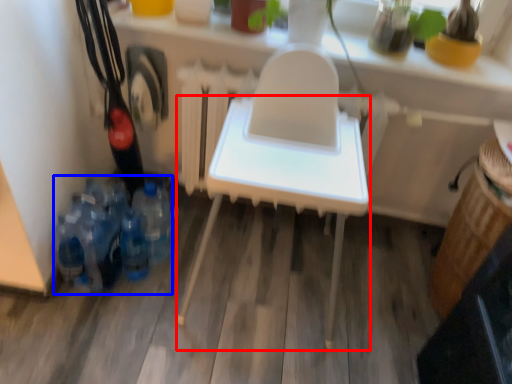
Question: Which object appears closest to the camera in this image, furniture (highlighted by a red box) or bottle (highlighted by a blue box)?

Choices:
 (A) furniture
 (B) bottle

Answer: (A)